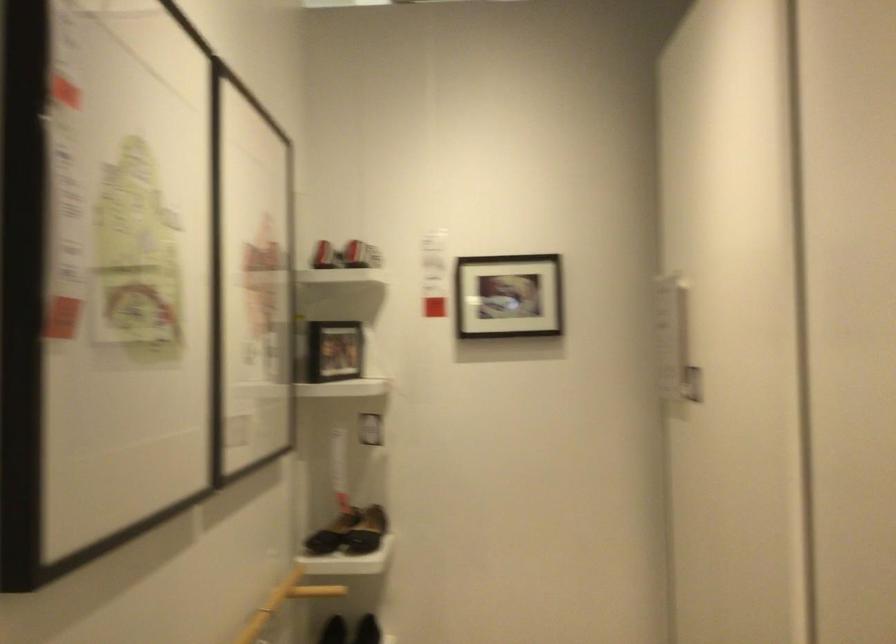
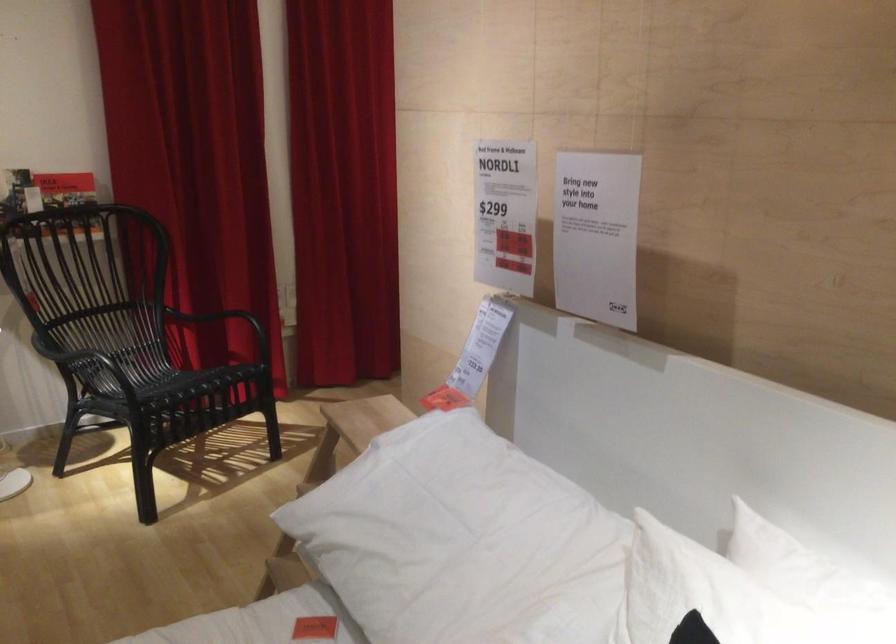
First-person continuous shooting, in which direction is the camera rotating?

The camera rotated toward left-down.